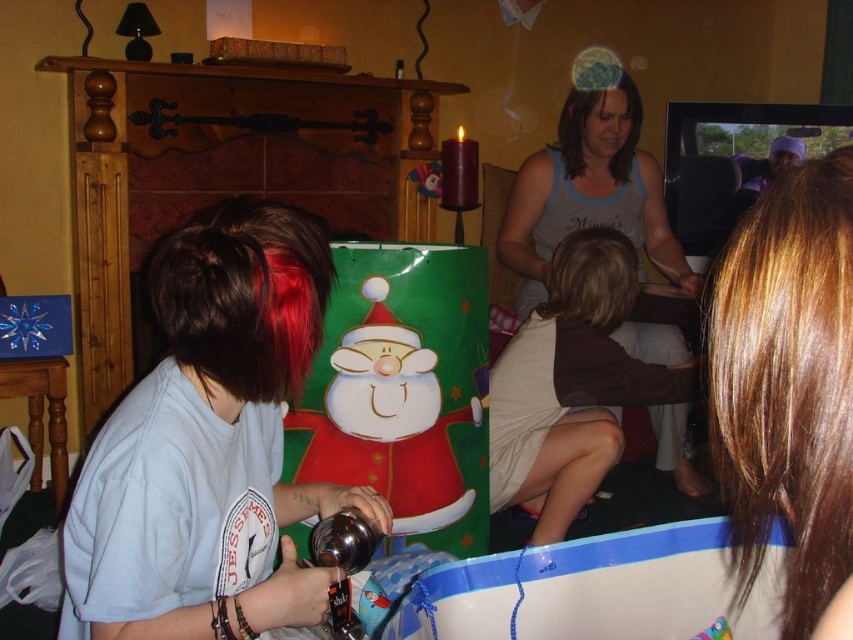
Between light blue cotton shirt at left and cartoon santa claus wrapping paper at center, which one has less height?

Standing shorter between the two is light blue cotton shirt at left.

Who is positioned more to the left, light blue cotton shirt at left or cartoon santa claus wrapping paper at center?

light blue cotton shirt at left is more to the left.

Who is more forward, (202, 468) or (437, 316)?

Point (202, 468) is in front.

Image resolution: width=853 pixels, height=640 pixels. What are the coordinates of `light blue cotton shirt at left` in the screenshot? It's located at (209, 444).

Does point (300, 273) come in front of point (840, 636)?

No, it is not.

Describe the element at coordinates (209, 444) in the screenshot. The height and width of the screenshot is (640, 853). I see `light blue cotton shirt at left` at that location.

What do you see at coordinates (209, 444) in the screenshot? I see `light blue cotton shirt at left` at bounding box center [209, 444].

Identify the location of light blue cotton shirt at left. (209, 444).

Consider the image. Can you confirm if cartoon santa claus wrapping paper at center is thinner than gray tank top at center?

Yes, cartoon santa claus wrapping paper at center is thinner than gray tank top at center.

Who is lower down, cartoon santa claus wrapping paper at center or gray tank top at center?

Positioned lower is cartoon santa claus wrapping paper at center.

Image resolution: width=853 pixels, height=640 pixels. What are the coordinates of `cartoon santa claus wrapping paper at center` in the screenshot? It's located at (399, 396).